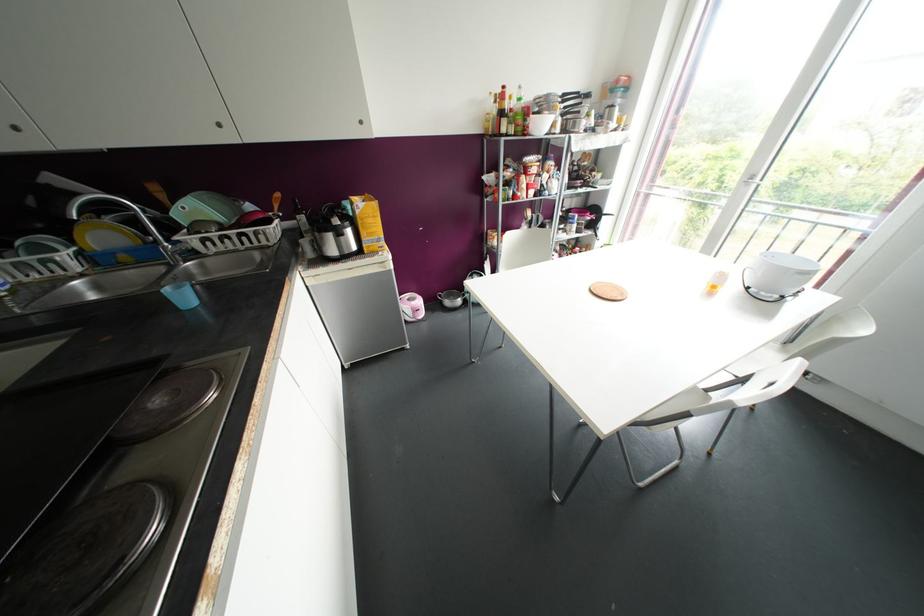
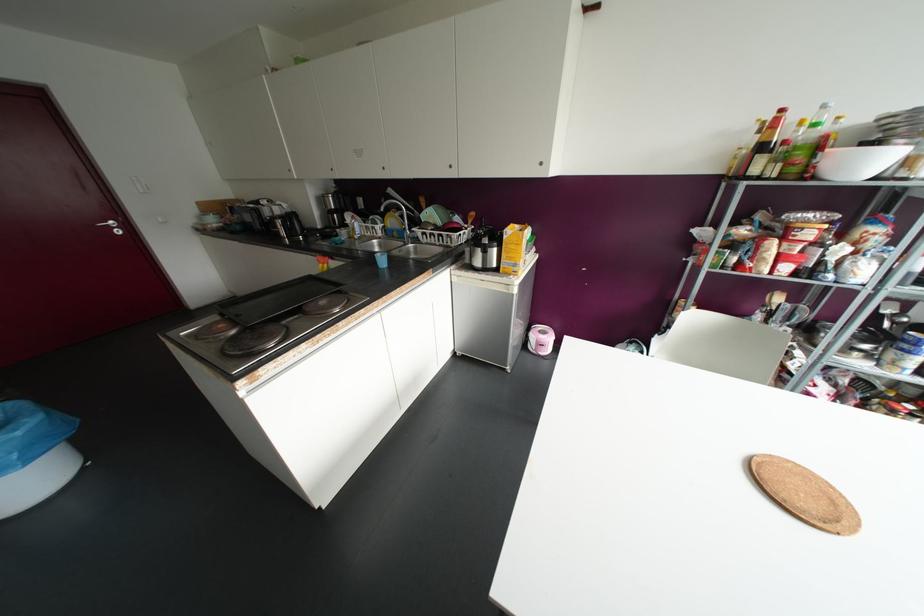
Where in the second image is the point corresponding to (x=184, y=297) from the first image?

(382, 261)